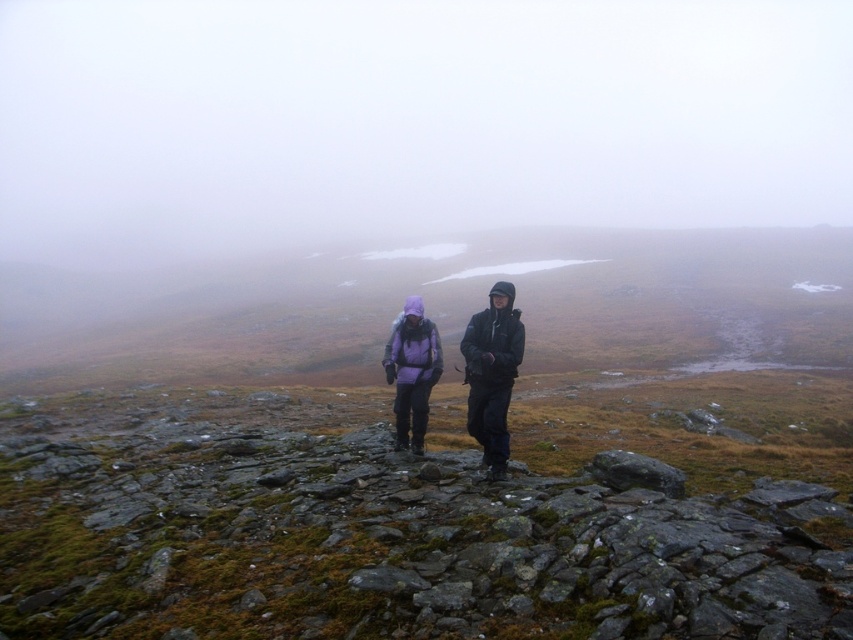
You are planning to take a photo of the two hikers in the scene. The photographer wants to ensure that both jackets are clearly visible in the frame. Given that the dark gray jacket at center is taller than the purple fleece jacket at center, which jacket should be positioned closer to the camera to ensure both are fully visible?

The dark gray jacket at center should be positioned closer to the camera because it has a greater height compared to the purple fleece jacket at center, ensuring both jackets are fully visible in the frame.

You are a hiker trying to locate your friend who is wearing a matte purple jacket at center. Based on the coordinates provided, where would you look in the image?

The matte purple jacket at center is located at the coordinates point (492, 372) in the image.

You are a hiker planning to join the group in the image. You need to know the distance between the two purple jackets to ensure there is enough space for your gear. Can you confirm if the distance between the matte purple jacket at center and the purple fleece jacket at center is at least 1 meter?

The matte purple jacket at center and the purple fleece jacket at center are 1.15 meters apart, which is more than 1 meter, so there is enough space for your gear between them.